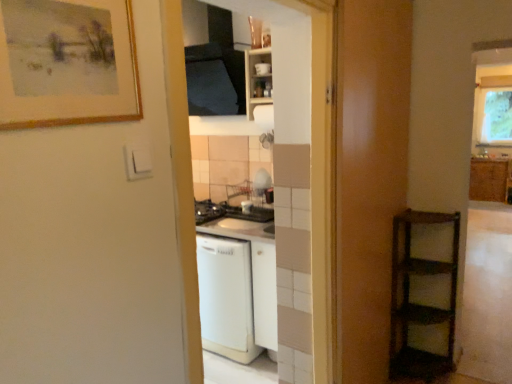
Question: From a real-world perspective, is white glossy dishwasher at center, the 2th screen door when ordered from right to left, located higher than wooden-framed painting at upper left?

Choices:
 (A) yes
 (B) no

Answer: (B)

Question: Is white glossy dishwasher at center, marked as the first screen door in a left-to-right arrangement, thinner than wooden-framed painting at upper left?

Choices:
 (A) no
 (B) yes

Answer: (A)

Question: Is white glossy dishwasher at center, the 2th screen door when ordered from right to left, at the left side of wooden-framed painting at upper left?

Choices:
 (A) no
 (B) yes

Answer: (A)

Question: Considering the relative sizes of white glossy dishwasher at center, marked as the first screen door in a left-to-right arrangement, and wooden-framed painting at upper left in the image provided, is white glossy dishwasher at center, marked as the first screen door in a left-to-right arrangement, wider than wooden-framed painting at upper left?

Choices:
 (A) yes
 (B) no

Answer: (A)

Question: Is wooden-framed painting at upper left inside white glossy dishwasher at center, the 2th screen door when ordered from right to left?

Choices:
 (A) yes
 (B) no

Answer: (B)

Question: From the image's perspective, relative to wooden shelf at right, the 2th screen door positioned from the left, is white matte cabinet at upper center, placed as the 1th cabinetry when sorted from front to back, above or below?

Choices:
 (A) below
 (B) above

Answer: (B)

Question: Is point (267, 99) positioned closer to the camera than point (371, 43)?

Choices:
 (A) farther
 (B) closer

Answer: (A)

Question: Is white matte cabinet at upper center, placed as the 1th cabinetry when sorted from front to back, wider or thinner than wooden shelf at right, the 2th screen door positioned from the left?

Choices:
 (A) thin
 (B) wide

Answer: (B)

Question: Is white matte cabinet at upper center, marked as the 2th cabinetry in a back-to-front arrangement, spatially inside wooden shelf at right, positioned as the first screen door in right-to-left order, or outside of it?

Choices:
 (A) inside
 (B) outside

Answer: (B)

Question: Is white matte cabinet at upper center, arranged as the first cabinetry when viewed from the left, inside or outside of white matte dishwasher at center?

Choices:
 (A) inside
 (B) outside

Answer: (B)

Question: From a real-world perspective, relative to white matte dishwasher at center, is white matte cabinet at upper center, marked as the 2th cabinetry in a back-to-front arrangement, vertically above or below?

Choices:
 (A) above
 (B) below

Answer: (A)

Question: Is white matte cabinet at upper center, arranged as the first cabinetry when viewed from the left, wider or thinner than white matte dishwasher at center?

Choices:
 (A) wide
 (B) thin

Answer: (B)

Question: Considering the positions of white matte cabinet at upper center, marked as the 2th cabinetry in a back-to-front arrangement, and white matte dishwasher at center in the image, is white matte cabinet at upper center, marked as the 2th cabinetry in a back-to-front arrangement, taller or shorter than white matte dishwasher at center?

Choices:
 (A) tall
 (B) short

Answer: (B)

Question: Visually, is white matte dishwasher at center positioned to the left or to the right of wooden shelf at right, the 2th screen door positioned from the left?

Choices:
 (A) left
 (B) right

Answer: (A)

Question: Considering the positions of white matte dishwasher at center and wooden shelf at right, positioned as the first screen door in right-to-left order, in the image, is white matte dishwasher at center bigger or smaller than wooden shelf at right, positioned as the first screen door in right-to-left order,?

Choices:
 (A) small
 (B) big

Answer: (B)